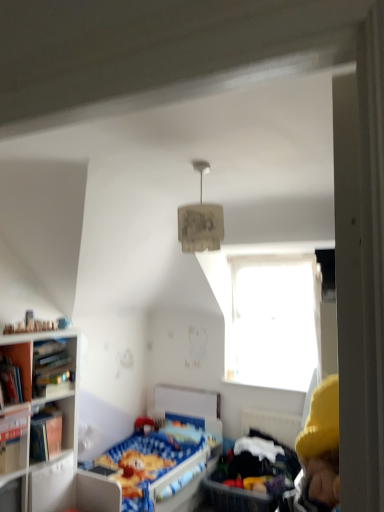
What are the coordinates of `free space above matte beige lampshade at center (from a real-world perspective)` in the screenshot? It's located at (189, 164).